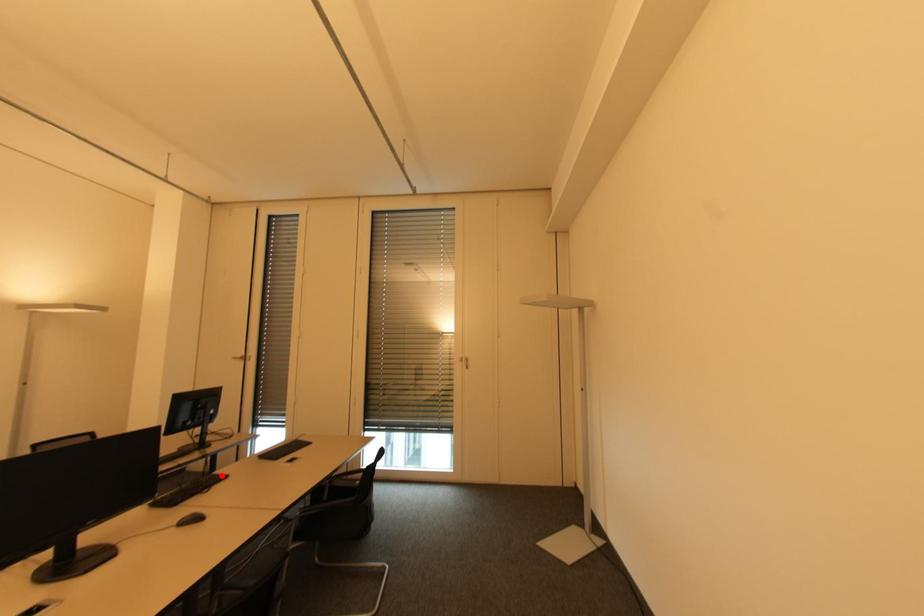
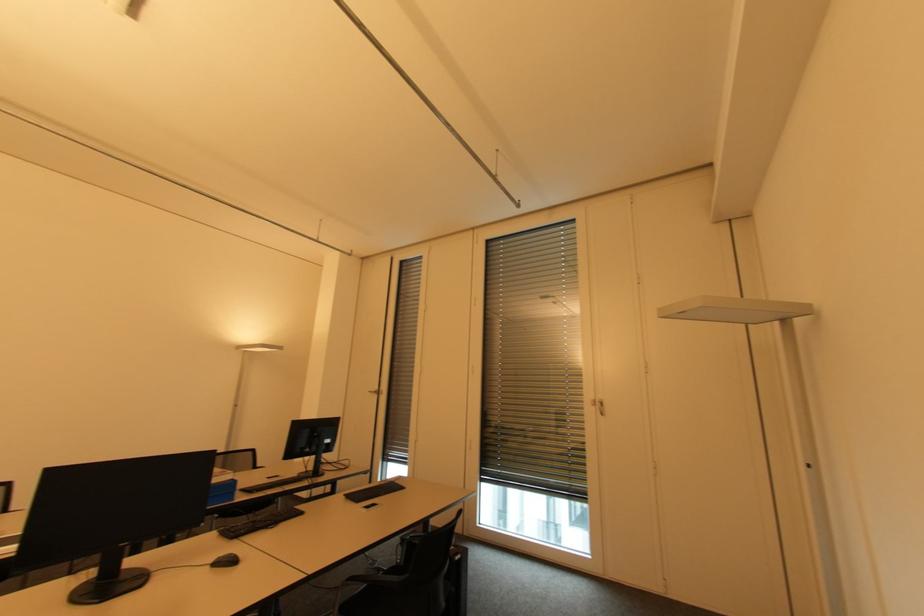
Locate, in the second image, the point that corresponds to the highlighted location in the first image.

(300, 511)